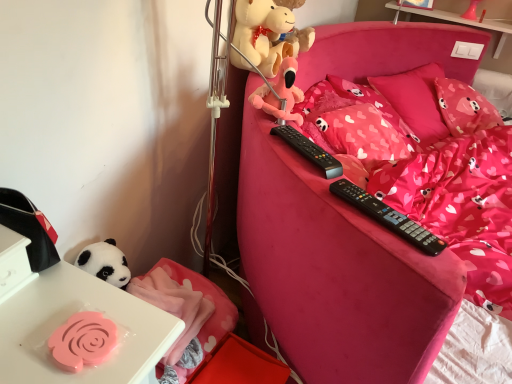
Where is `empty space that is ontop of pink fabric pillow at upper right, positioned as the 1th pillow in left-to-right order (from a real-world perspective)`? The width and height of the screenshot is (512, 384). empty space that is ontop of pink fabric pillow at upper right, positioned as the 1th pillow in left-to-right order (from a real-world perspective) is located at coordinates (421, 74).